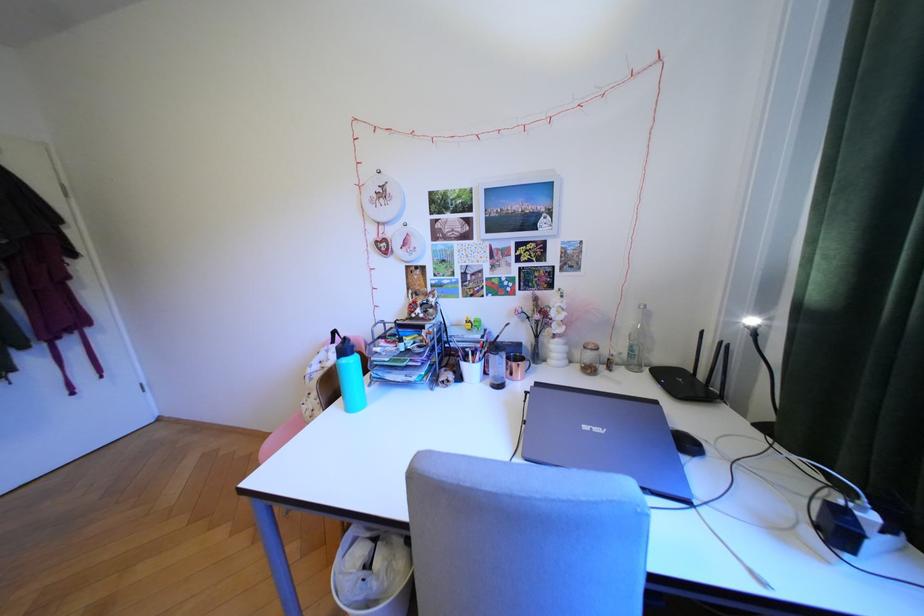
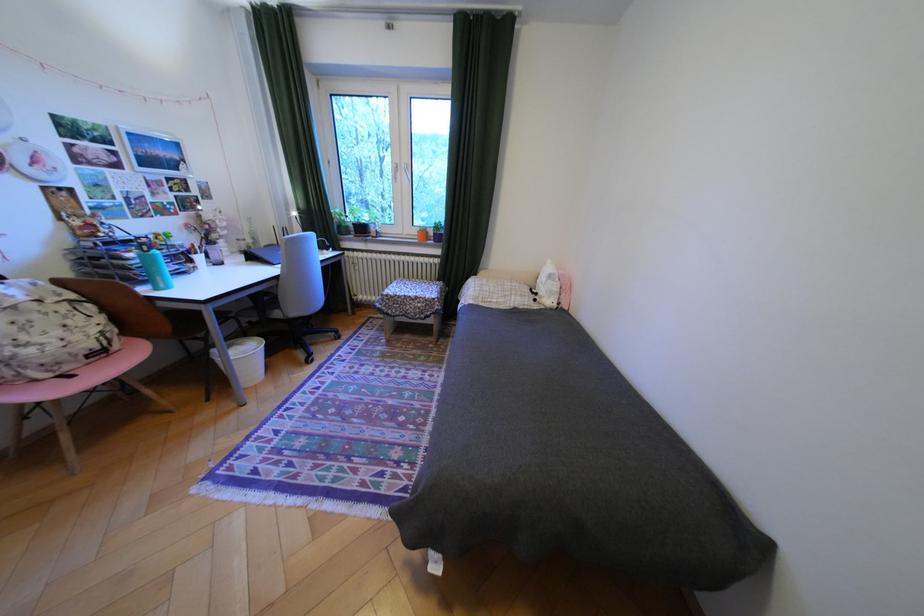
In the second image, find the point that corresponds to point 400,545 in the first image.

(249, 345)